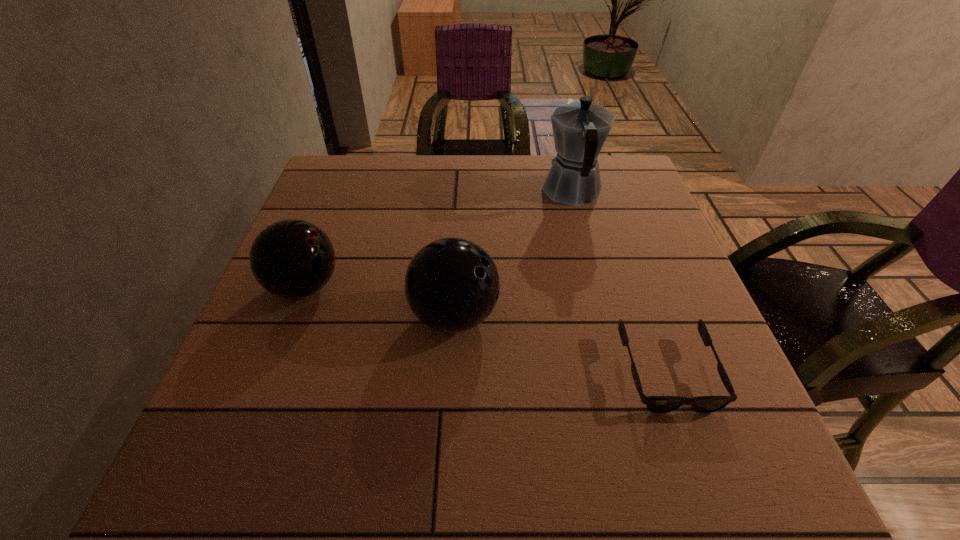
The width and height of the screenshot is (960, 540). In the image, there is a desktop. What are the coordinates of `vacant area at the far right corner` in the screenshot? It's located at (635, 182).

What are the coordinates of `vacant area that lies between the left bowling ball and the shortest object` in the screenshot? It's located at (486, 329).

Find the location of a particular element. empty space between the coffeepot and the second object from left to right is located at coordinates (514, 253).

Locate an element on the screen. The height and width of the screenshot is (540, 960). unoccupied area between the farthest object and the right bowling ball is located at coordinates (514, 253).

The image size is (960, 540). I want to click on free space between the leftmost object and the farthest object, so click(x=439, y=239).

You are a GUI agent. You are given a task and a screenshot of the screen. Output one action in this format:
    pyautogui.click(x=<x>, y=<y>)
    Task: Click on the free spot between the shortest object and the coffeepot
    The width and height of the screenshot is (960, 540).
    Given the screenshot: What is the action you would take?
    pyautogui.click(x=620, y=282)

The height and width of the screenshot is (540, 960). In order to click on vacant region between the second object from left to right and the coffeepot in this screenshot , I will do `click(514, 253)`.

What are the coordinates of `blank region between the left bowling ball and the sunglasses` in the screenshot? It's located at (486, 329).

Locate an element on the screen. Image resolution: width=960 pixels, height=540 pixels. blank region between the right bowling ball and the coffeepot is located at coordinates click(x=514, y=253).

This screenshot has height=540, width=960. I want to click on free space between the sunglasses and the coffeepot, so click(x=620, y=282).